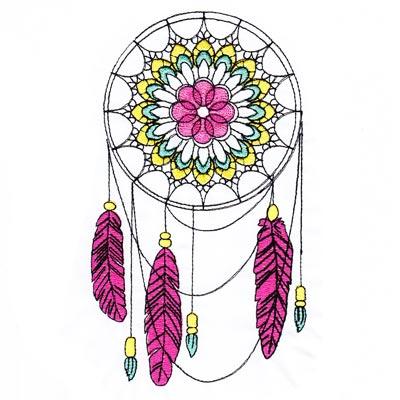
Where is `art`? Image resolution: width=400 pixels, height=400 pixels. art is located at coordinates (213, 164).